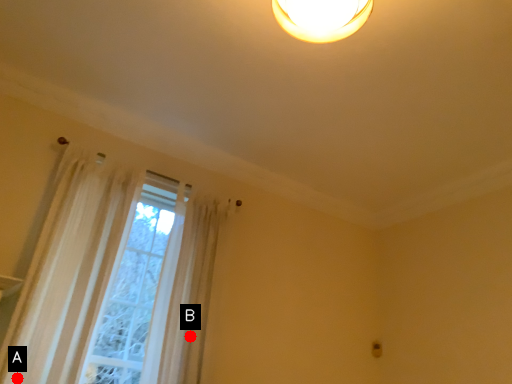
Question: Two points are circled on the image, labeled by A and B beside each circle. Which of the following is the farthest from the observer?

Choices:
 (A) A is further
 (B) B is further

Answer: (B)